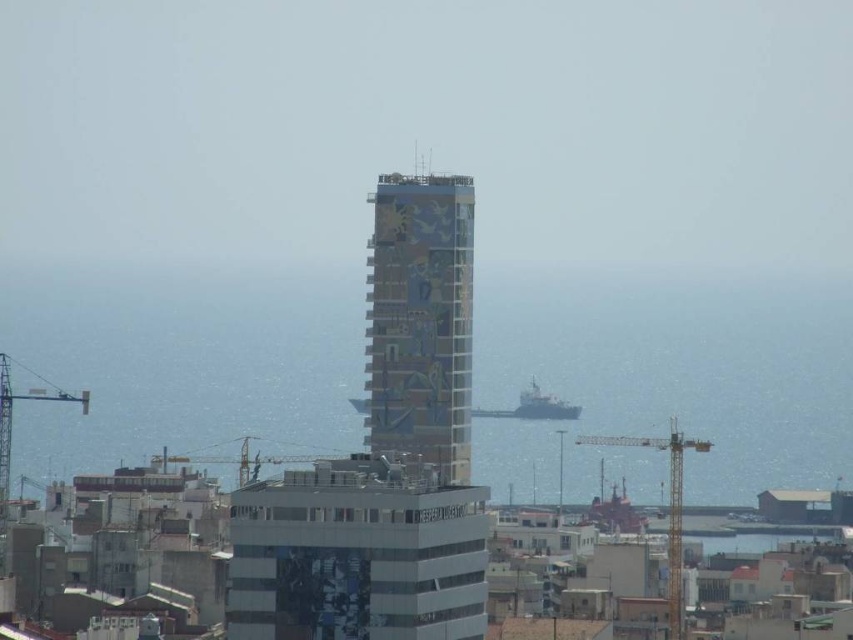
Who is positioned more to the right, multicolored mosaic tower at center or yellow metallic crane at lower center?

multicolored mosaic tower at center is more to the right.

Can you confirm if multicolored mosaic tower at center is thinner than yellow metallic crane at lower center?

Correct, multicolored mosaic tower at center's width is less than yellow metallic crane at lower center's.

Who is more distant from viewer, (442, 266) or (242, 474)?

The point (242, 474) is behind.

The height and width of the screenshot is (640, 853). In order to click on multicolored mosaic tower at center in this screenshot , I will do `click(421, 321)`.

Can you confirm if multicolored mosaic tower at center is thinner than yellow metallic crane at lower right?

Correct, multicolored mosaic tower at center's width is less than yellow metallic crane at lower right's.

Who is more forward, (x=428, y=243) or (x=672, y=432)?

Point (x=428, y=243)

Is point (463, 189) less distant than point (669, 584)?

Yes, point (463, 189) is in front of point (669, 584).

At what (x,y) coordinates should I click in order to perform the action: click on multicolored mosaic tower at center. Please return your answer as a coordinate pair (x, y). This screenshot has width=853, height=640. Looking at the image, I should click on (421, 321).

Is white glass building at center shorter than yellow metallic crane at lower right?

Correct, white glass building at center is not as tall as yellow metallic crane at lower right.

Does white glass building at center have a greater height compared to yellow metallic crane at lower right?

Incorrect, white glass building at center's height is not larger of yellow metallic crane at lower right's.

Who is more forward, (444, 536) or (705, 440)?

Point (444, 536) is in front.

Locate an element on the screen. Image resolution: width=853 pixels, height=640 pixels. white glass building at center is located at coordinates (357, 554).